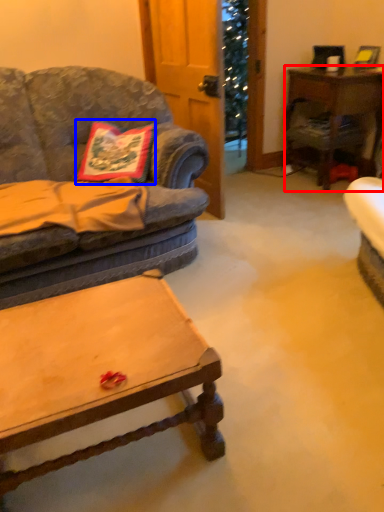
Question: Which point is closer to the camera, desk (highlighted by a red box) or pillow (highlighted by a blue box)?

Choices:
 (A) desk
 (B) pillow

Answer: (B)